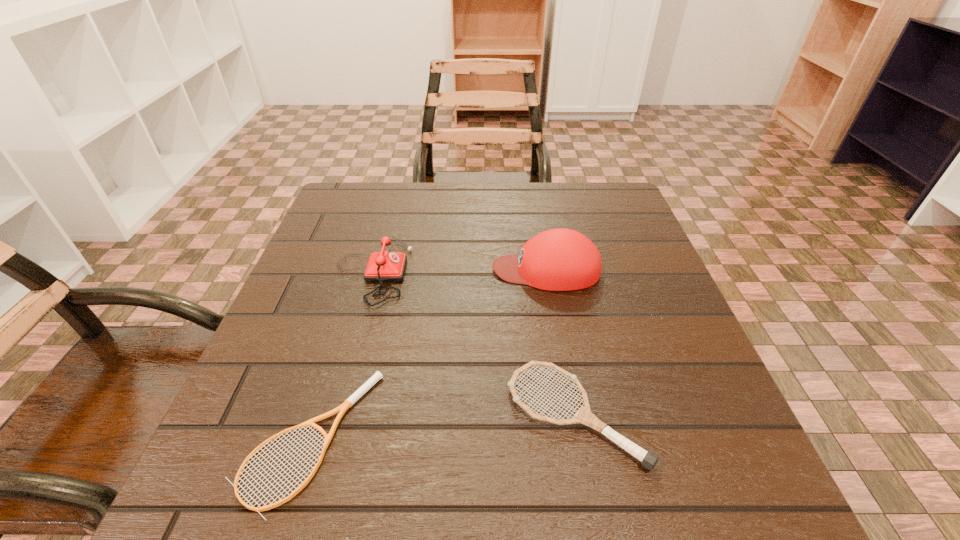
This screenshot has width=960, height=540. What are the coordinates of `vacant space that is in between the second shortest object and the telephone` in the screenshot? It's located at (473, 343).

Identify the location of free space between the telephone and the third tallest object. The image size is (960, 540). (473, 343).

Where is `free space between the right tennis racket and the telephone`? This screenshot has height=540, width=960. free space between the right tennis racket and the telephone is located at coordinates (473, 343).

Identify the location of vacant area that lies between the third shortest object and the second shortest object. (473, 343).

This screenshot has width=960, height=540. I want to click on vacant space in between the right tennis racket and the telephone, so click(473, 343).

Locate an element on the screen. unoccupied area between the shortest object and the third shortest object is located at coordinates (340, 355).

Identify the location of the closest object relative to the shorter tennis racket. The image size is (960, 540). (384, 266).

Identify the location of object that stands as the third closest to the tallest object. (348, 403).

Locate an element on the screen. The image size is (960, 540). free spot that satisfies the following two spatial constraints: 1. on the front-facing side of the tallest object; 2. on the back side of the taller tennis racket is located at coordinates (572, 415).

At what (x,y) coordinates should I click in order to perform the action: click on free point that satisfies the following two spatial constraints: 1. on the dial of the right tennis racket; 2. on the left side of the third shortest object. Please return your answer as a coordinate pair (x, y). Looking at the image, I should click on (331, 415).